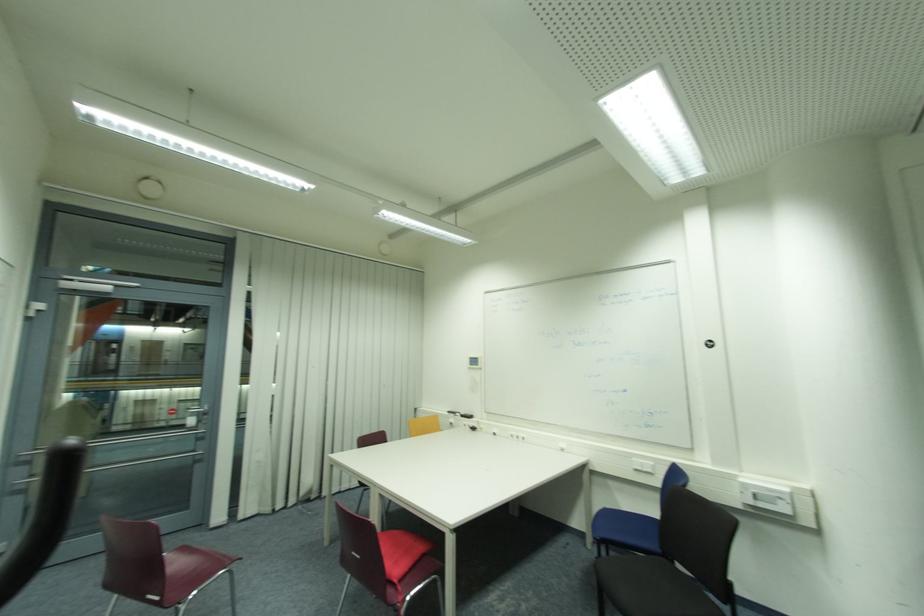
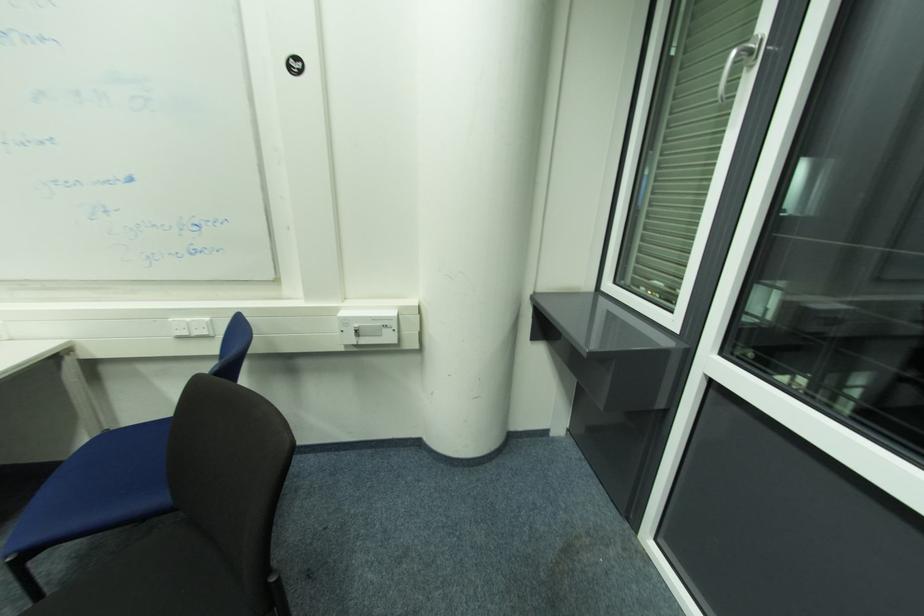
In the second image, find the point that corresponds to point (647, 462) in the first image.

(191, 320)